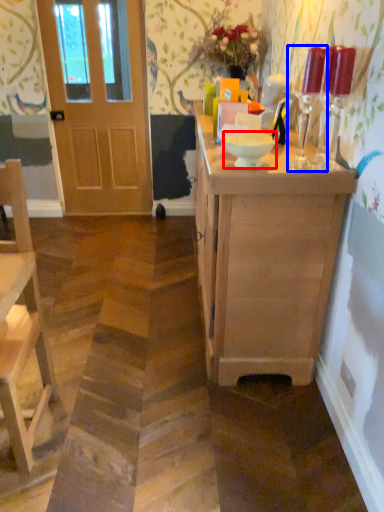
Question: Among these objects, which one is nearest to the camera, bowl (highlighted by a red box) or candle holder (highlighted by a blue box)?

Choices:
 (A) bowl
 (B) candle holder

Answer: (B)